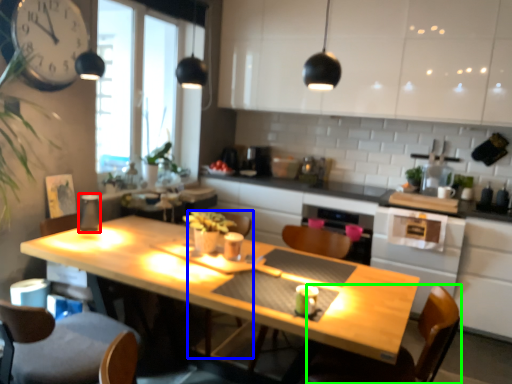
Question: Which object is positioned closest to appliance (highlighted by a red box)? Select from armchair (highlighted by a blue box) and swivel chair (highlighted by a green box).

Choices:
 (A) armchair
 (B) swivel chair

Answer: (A)